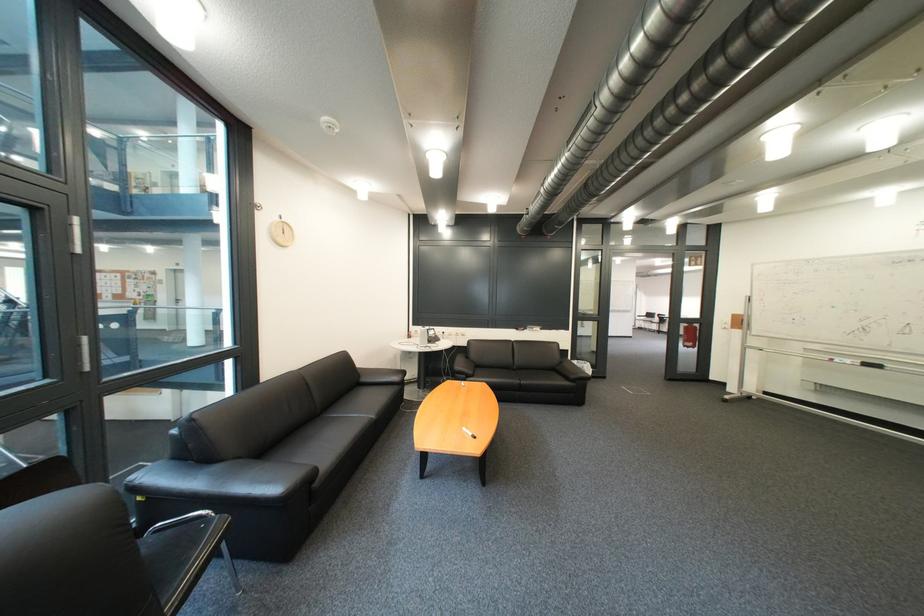
Find where to writ the red whiteboard marker. Please return your answer as a coordinate pair (x, y).

(842, 360)